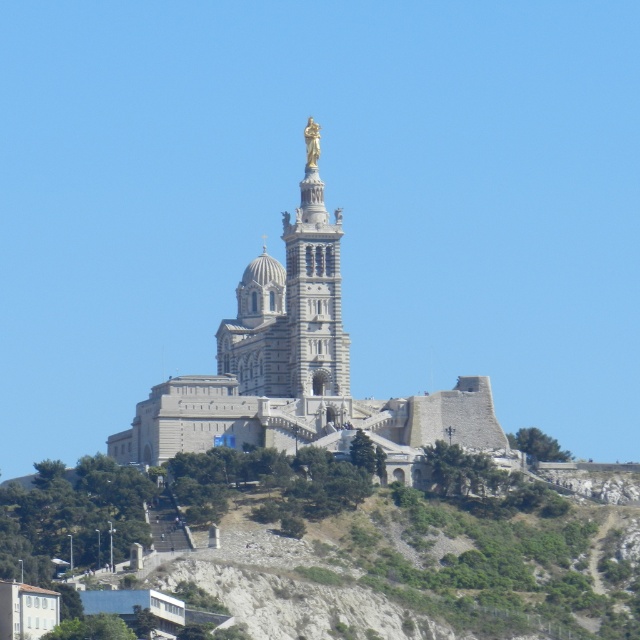
From the picture: Is beige stone church at center thinner than gold metallic statue at center?

No.

Which is behind, point (179, 444) or point (314, 177)?

Point (314, 177)

Is point (300, 218) more distant than point (332, 307)?

Yes, it is.

I want to click on beige stone church at center, so click(301, 372).

Does beige stone church at center appear under gold polished statue at upper center?

Yes, beige stone church at center is below gold polished statue at upper center.

I want to click on beige stone church at center, so click(301, 372).

Is point (237, 291) more distant than point (310, 122)?

Yes, point (237, 291) is behind point (310, 122).

This screenshot has height=640, width=640. Find the location of `beige stone church at center`. beige stone church at center is located at coordinates (301, 372).

Who is taller, gold metallic statue at center or gold polished statue at upper center?

Standing taller between the two is gold metallic statue at center.

Can you confirm if gold metallic statue at center is thinner than gold polished statue at upper center?

No, gold metallic statue at center is not thinner than gold polished statue at upper center.

Is point (314, 282) behind point (317, 132)?

No, (314, 282) is closer to viewer.

Identify the location of gold metallic statue at center. (314, 288).